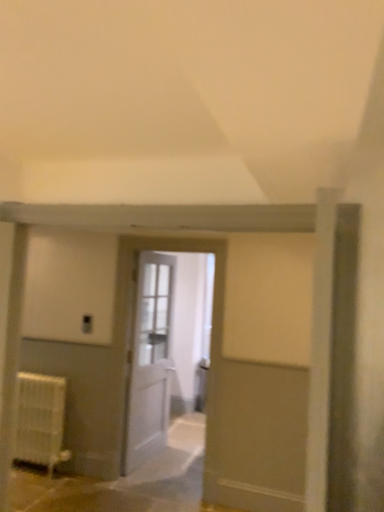
In order to face white wooden door at center, acting as the 2th door starting from the front, should I rotate leftwards or rightwards?

Rotate left and turn 5.880 degrees.

Image resolution: width=384 pixels, height=512 pixels. In order to click on white wooden door at center, which is counted as the 2th door, starting from the back in this screenshot , I will do pyautogui.click(x=134, y=305).

In the image, is white wooden door at center, which is counted as the 2th door, starting from the back, positioned in front of or behind white wooden door at center, acting as the 2th door starting from the front?

Clearly, white wooden door at center, which is counted as the 2th door, starting from the back, is in front of white wooden door at center, acting as the 2th door starting from the front.

From a real-world perspective, which is physically below, white wooden door at center, which ranks as the first door in front-to-back order, or white wooden door at center, acting as the 2th door starting from the front?

From a 3D spatial view, white wooden door at center, acting as the 2th door starting from the front, is below.

Which is closer to the camera, (121, 327) or (148, 300)?

Point (121, 327) is closer to the camera than point (148, 300).

What's the angular difference between white wooden door at center, which ranks as the first door in front-to-back order, and white wooden door at center, acting as the 2th door starting from the front,'s facing directions?

white wooden door at center, which ranks as the first door in front-to-back order, and white wooden door at center, acting as the 2th door starting from the front, are facing 81.1 degrees away from each other.

Which of these two, white matte radiator at lower left or white wooden door at center, which is counted as the 2th door, starting from the back, is thinner?

white wooden door at center, which is counted as the 2th door, starting from the back.

Measure the distance from white matte radiator at lower left to white wooden door at center, which ranks as the first door in front-to-back order.

A distance of 77.67 centimeters exists between white matte radiator at lower left and white wooden door at center, which ranks as the first door in front-to-back order.

Who is taller, white matte radiator at lower left or white wooden door at center, which is counted as the 2th door, starting from the back?

white wooden door at center, which is counted as the 2th door, starting from the back, is taller.

Is white matte radiator at lower left oriented towards white wooden door at center, which is counted as the 2th door, starting from the back?

No, white matte radiator at lower left is not aimed at white wooden door at center, which is counted as the 2th door, starting from the back.

The image size is (384, 512). I want to click on door located above the white wooden door at center, which is the 1th door in back-to-front order (from a real-world perspective), so click(x=134, y=305).

From the image's perspective, is white wooden door at center, acting as the 2th door starting from the front, located above or below white wooden door at center, which ranks as the first door in front-to-back order?

From the image's perspective, white wooden door at center, acting as the 2th door starting from the front, appears below white wooden door at center, which ranks as the first door in front-to-back order.

Does white wooden door at center, which is the 1th door in back-to-front order, come in front of white wooden door at center, which is counted as the 2th door, starting from the back?

That is False.

How different are the orientations of white wooden door at center, which is the 1th door in back-to-front order, and white wooden door at center, which is counted as the 2th door, starting from the back, in degrees?

81.1 degrees.

Which is more to the right, white wooden door at center, acting as the 2th door starting from the front, or white matte radiator at lower left?

white wooden door at center, acting as the 2th door starting from the front, is more to the right.

Is white wooden door at center, acting as the 2th door starting from the front, inside or outside of white matte radiator at lower left?

white wooden door at center, acting as the 2th door starting from the front, lies outside white matte radiator at lower left.

How distant is white wooden door at center, which is the 1th door in back-to-front order, from white matte radiator at lower left?

They are 30.40 inches apart.

Can you confirm if white wooden door at center, which is the 1th door in back-to-front order, is smaller than white matte radiator at lower left?

Incorrect, white wooden door at center, which is the 1th door in back-to-front order, is not smaller in size than white matte radiator at lower left.

How much distance is there between white matte radiator at lower left and white wooden door at center, acting as the 2th door starting from the front?

The distance of white matte radiator at lower left from white wooden door at center, acting as the 2th door starting from the front, is 30.40 inches.

Who is taller, white matte radiator at lower left or white wooden door at center, acting as the 2th door starting from the front?

white wooden door at center, acting as the 2th door starting from the front, is taller.

Does white matte radiator at lower left have a smaller size compared to white wooden door at center, acting as the 2th door starting from the front?

Correct, white matte radiator at lower left occupies less space than white wooden door at center, acting as the 2th door starting from the front.

Considering the positions of points (130, 258) and (29, 436), is point (130, 258) farther from camera compared to point (29, 436)?

Yes, point (130, 258) is farther from viewer.

Is white wooden door at center, which ranks as the first door in front-to-back order, wider than white matte radiator at lower left?

No.

Who is bigger, white wooden door at center, which ranks as the first door in front-to-back order, or white matte radiator at lower left?

white wooden door at center, which ranks as the first door in front-to-back order, is bigger.

From the image's perspective, between white wooden door at center, which ranks as the first door in front-to-back order, and white matte radiator at lower left, which one is located above?

white wooden door at center, which ranks as the first door in front-to-back order, is shown above in the image.

The height and width of the screenshot is (512, 384). I want to click on door below the white wooden door at center, which ranks as the first door in front-to-back order (from a real-world perspective), so click(149, 362).

Where is `the 2nd door counting from the right of the white matte radiator at lower left`? The width and height of the screenshot is (384, 512). the 2nd door counting from the right of the white matte radiator at lower left is located at coordinates (134, 305).

Considering their positions, is white matte radiator at lower left positioned closer to white wooden door at center, which is counted as the 2th door, starting from the back, than white wooden door at center, acting as the 2th door starting from the front?

Among the two, white wooden door at center, acting as the 2th door starting from the front, is located nearer to white wooden door at center, which is counted as the 2th door, starting from the back.

Based on their spatial positions, is white matte radiator at lower left or white wooden door at center, which is counted as the 2th door, starting from the back, further from white wooden door at center, which is the 1th door in back-to-front order?

white matte radiator at lower left.

Looking at this image, considering their positions, is white wooden door at center, which ranks as the first door in front-to-back order, positioned closer to white matte radiator at lower left than white wooden door at center, acting as the 2th door starting from the front?

white wooden door at center, acting as the 2th door starting from the front, lies closer to white matte radiator at lower left than the other object.

Estimate the real-world distances between objects in this image. Which object is further from white wooden door at center, which is counted as the 2th door, starting from the back, white wooden door at center, which is the 1th door in back-to-front order, or white matte radiator at lower left?

Based on the image, white matte radiator at lower left appears to be further to white wooden door at center, which is counted as the 2th door, starting from the back.

Which object lies nearer to the anchor point white wooden door at center, which is the 1th door in back-to-front order, white wooden door at center, which ranks as the first door in front-to-back order, or white matte radiator at lower left?

Based on the image, white wooden door at center, which ranks as the first door in front-to-back order, appears to be nearer to white wooden door at center, which is the 1th door in back-to-front order.

Based on the photo, which object lies further to the anchor point white matte radiator at lower left, white wooden door at center, acting as the 2th door starting from the front, or white wooden door at center, which is counted as the 2th door, starting from the back?

white wooden door at center, which is counted as the 2th door, starting from the back, is further to white matte radiator at lower left.

Locate an element on the screen. This screenshot has height=512, width=384. door between white matte radiator at lower left and white wooden door at center, which ranks as the first door in front-to-back order, in the horizontal direction is located at coordinates (149, 362).